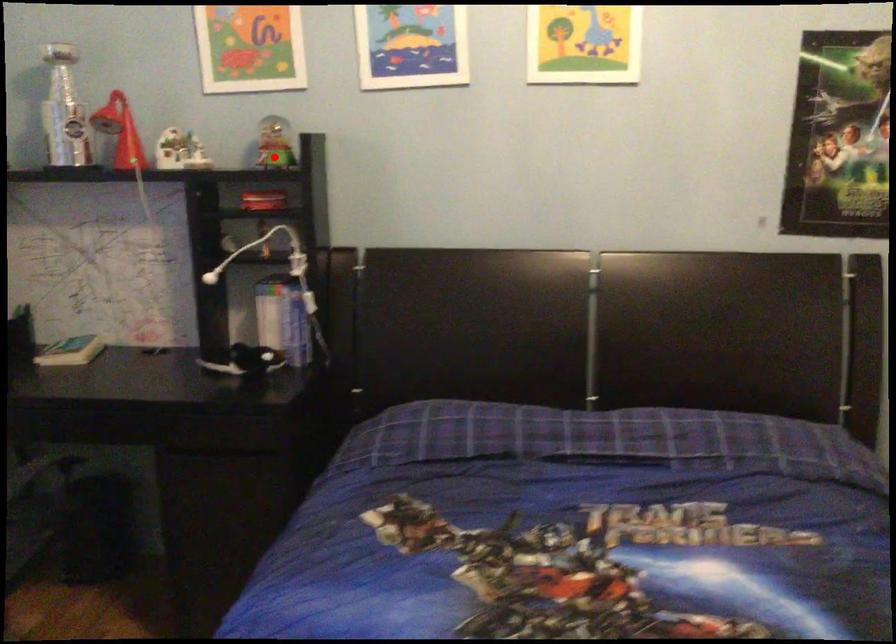
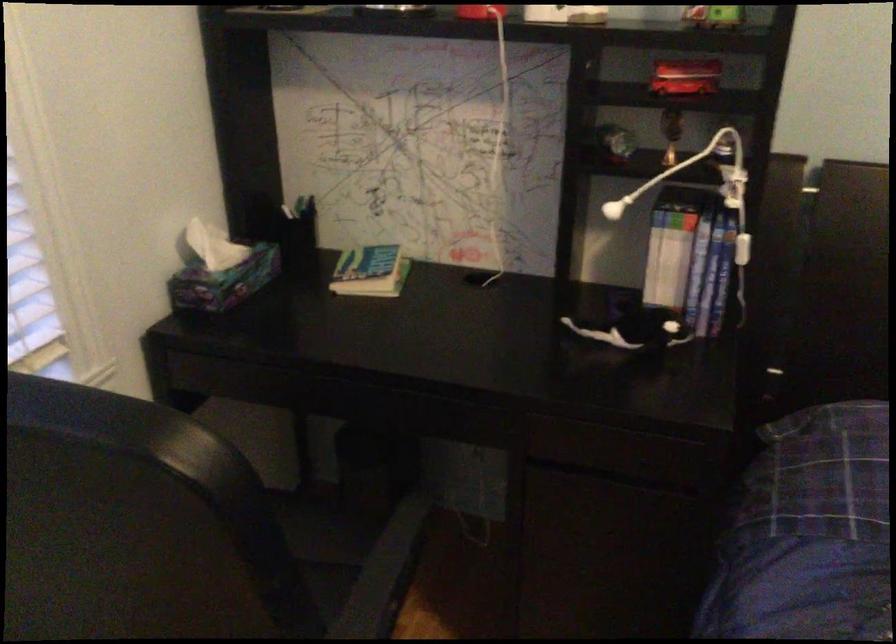
Question: I am providing you with two images of the same scene from different viewpoints. Given a red point in image1, look at the same physical point in image2. Is it:

Choices:
 (A) Closer to the viewpoint
 (B) Farther from the viewpoint

Answer: (A)